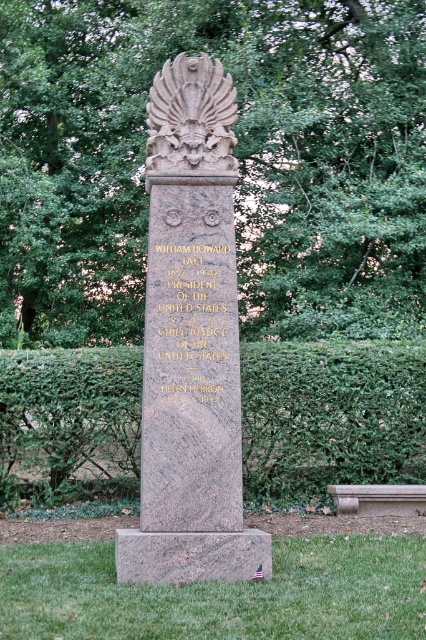
Based on the scene description, where is the carved stone eagle at center located in terms of its 2D coordinates?

The carved stone eagle at center is located at the 2D coordinates of point (x=190, y=120).

What is the spatial relationship between the green leafy tree at center and the green leafy hedge at center?

The green leafy tree at center is to the left of the green leafy hedge at center.